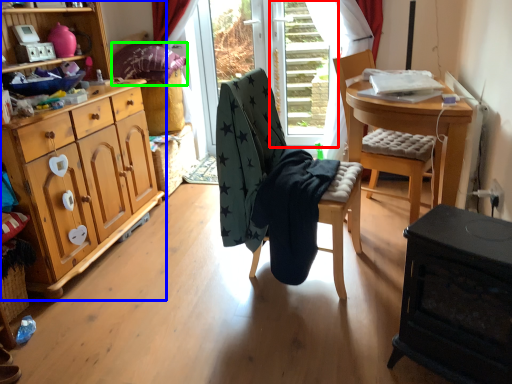
Question: Which object is positioned closest to screen door (highlighted by a red box)? Select from cabinetry (highlighted by a blue box) and pillow (highlighted by a green box).

Choices:
 (A) cabinetry
 (B) pillow

Answer: (B)